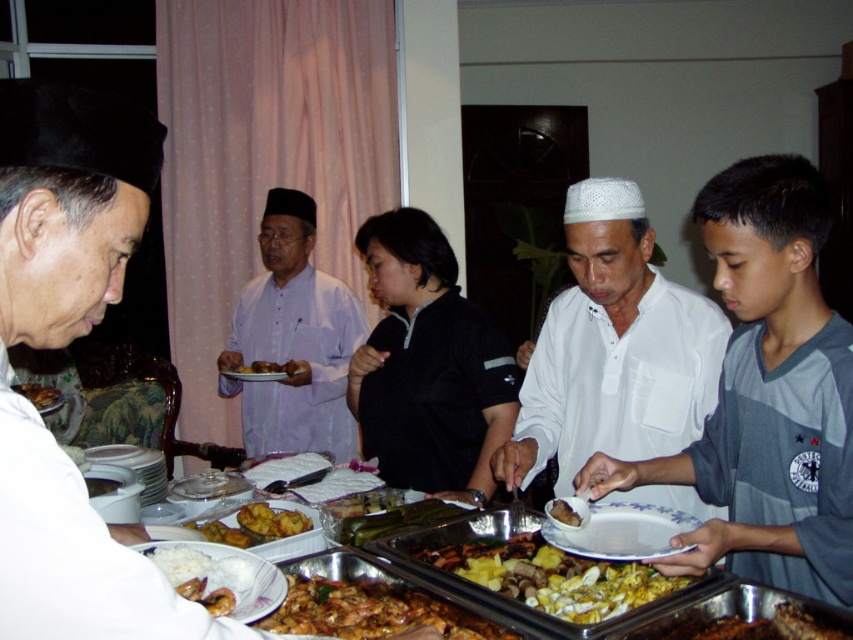
Does white matte shirt at center come in front of yellow/golden textured rice at lower center?

That is False.

The height and width of the screenshot is (640, 853). Identify the location of white matte shirt at center. (613, 349).

Looking at this image, does matte black hat at left appear over golden brown fried chicken at center?

Correct, matte black hat at left is located above golden brown fried chicken at center.

In the scene shown: Who is more distant from viewer, (149, 632) or (244, 372)?

Positioned behind is point (244, 372).

Locate an element on the screen. matte black hat at left is located at coordinates (64, 346).

Which is more to the right, brown glossy meat at center or golden brown fried chicken at center?

From the viewer's perspective, brown glossy meat at center appears more on the right side.

Is brown glossy meat at center taller than golden brown fried chicken at center?

In fact, brown glossy meat at center may be shorter than golden brown fried chicken at center.

Is point (389, 600) more distant than point (270, 364)?

No.

This screenshot has width=853, height=640. I want to click on brown glossy meat at center, so click(x=370, y=611).